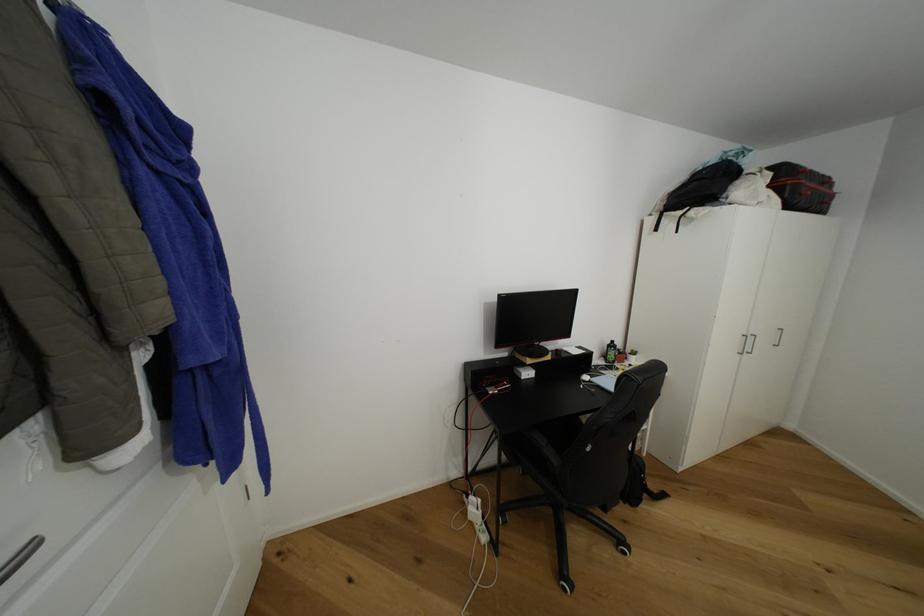
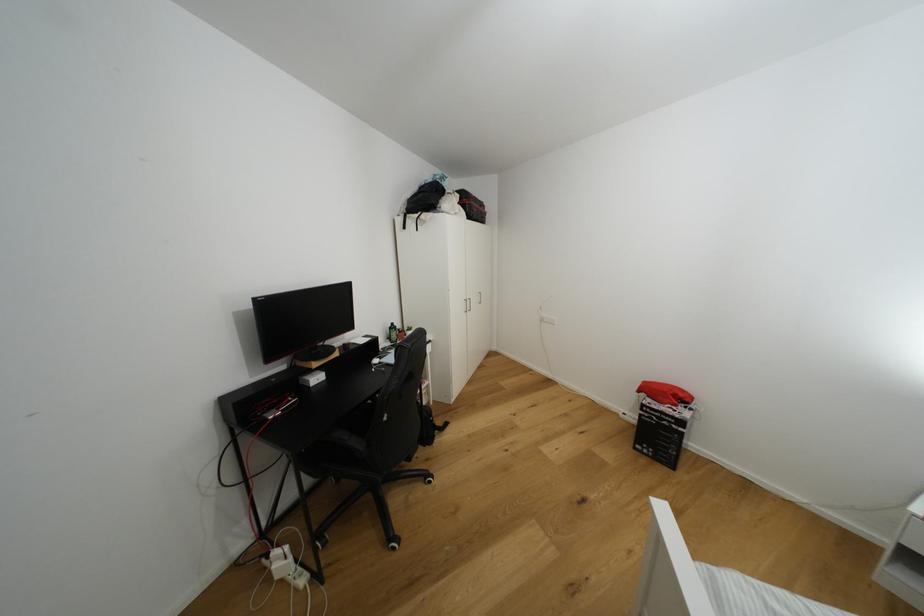
Where in the second image is the point corresponding to pixel 532 376 from the first image?

(322, 379)